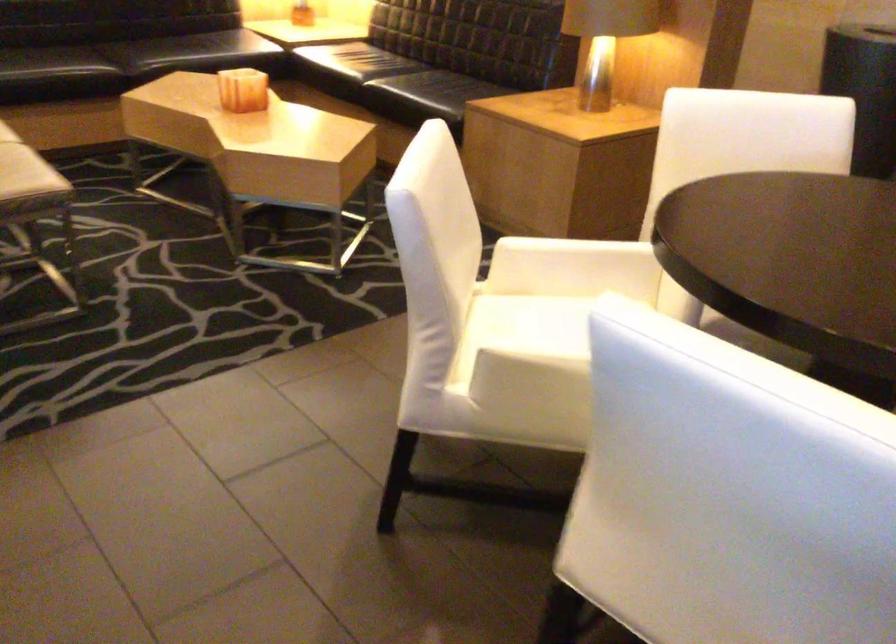
Image resolution: width=896 pixels, height=644 pixels. Describe the element at coordinates (526, 366) in the screenshot. I see `the white chair armrest` at that location.